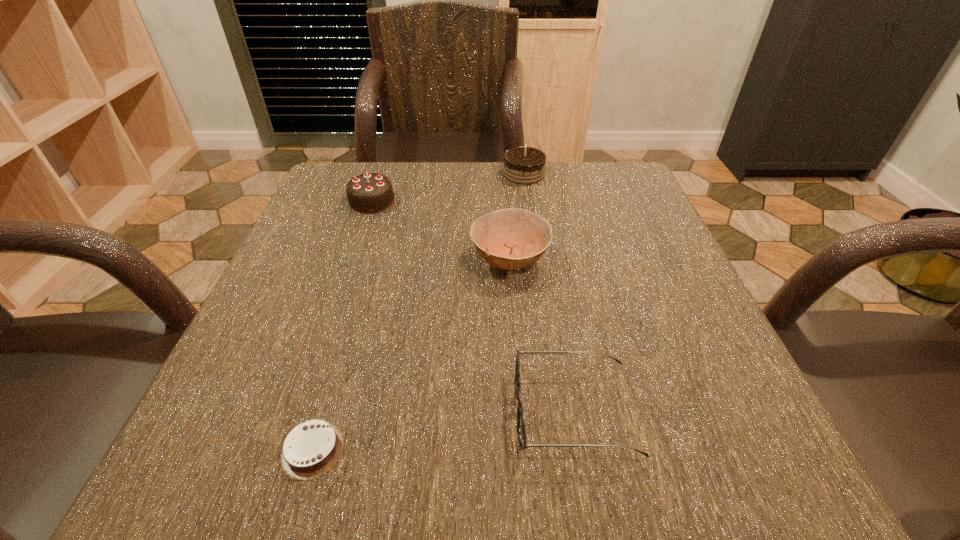
Image resolution: width=960 pixels, height=540 pixels. Identify the location of the farthest chocolate cake. (525, 165).

Find the location of a particular element. Image resolution: width=960 pixels, height=540 pixels. the farthest object is located at coordinates (525, 165).

The image size is (960, 540). In order to click on the fourth nearest object in this screenshot , I will do `click(372, 192)`.

This screenshot has width=960, height=540. Identify the location of bowl. (514, 238).

Identify the location of the second shortest object. The image size is (960, 540). (521, 409).

Find the location of a particular element. This screenshot has width=960, height=540. the shortest object is located at coordinates (312, 448).

Locate an element on the screen. the nearest chocolate cake is located at coordinates (312, 448).

Identify the location of free space located 0.100m on the right of the farthest object. (585, 174).

What are the coordinates of `vacant region located on the front of the second farthest object` in the screenshot? It's located at (344, 285).

Locate an element on the screen. The image size is (960, 540). vacant space located 0.070m on the left of the third farthest object is located at coordinates (434, 259).